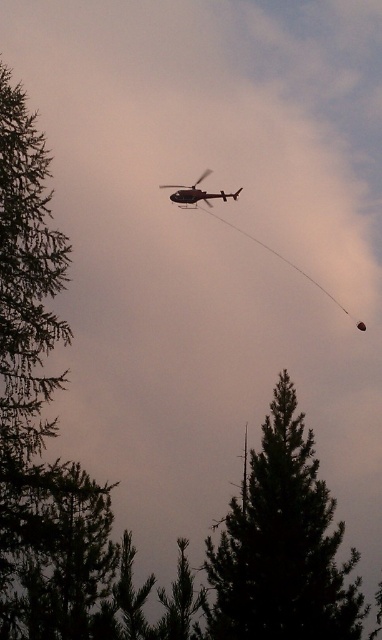
Who is positioned more to the right, dark green textured tree at center or metallic silver helicopter at upper center?

dark green textured tree at center is more to the right.

Who is more distant from viewer, (283, 518) or (223, 195)?

Point (223, 195)

Locate an element on the screen. dark green textured tree at center is located at coordinates (281, 545).